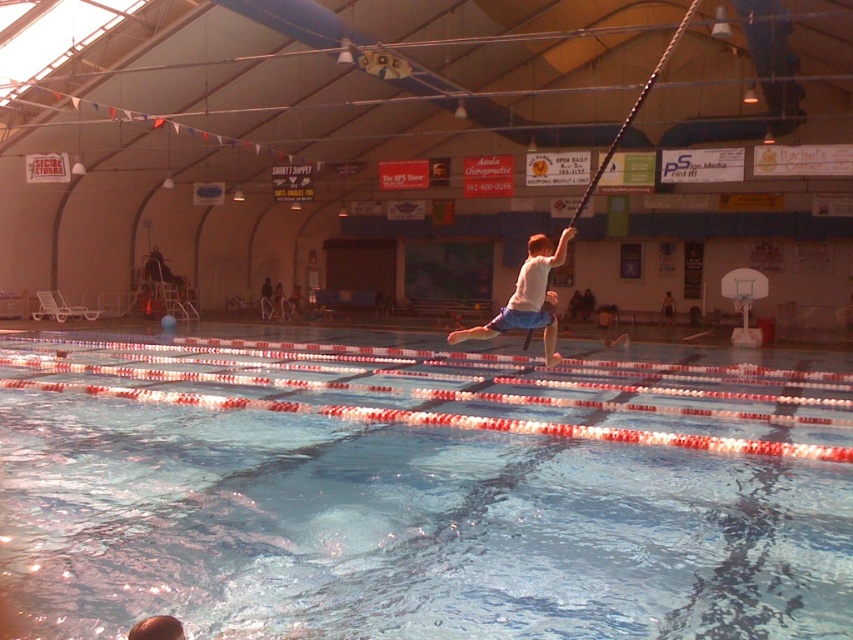
Is clear blue water at center below white matte shirt at center?

Correct, clear blue water at center is located below white matte shirt at center.

Which of these two, clear blue water at center or white matte shirt at center, stands shorter?

clear blue water at center is shorter.

Where is `clear blue water at center`? clear blue water at center is located at coordinates (416, 492).

Is white matte shirt at center smaller than light brown shorts at center?

No, white matte shirt at center is not smaller than light brown shorts at center.

Can you confirm if white matte shirt at center is positioned above light brown shorts at center?

Correct, white matte shirt at center is located above light brown shorts at center.

Is point (463, 337) more distant than point (670, 308)?

No, (463, 337) is in front of (670, 308).

Find the location of `white matte shirt at center`. white matte shirt at center is located at coordinates (527, 298).

Is clear blue water at center thinner than light brown shorts at center?

In fact, clear blue water at center might be wider than light brown shorts at center.

Looking at this image, which is above, clear blue water at center or light brown shorts at center?

Positioned higher is light brown shorts at center.

The image size is (853, 640). What do you see at coordinates (416, 492) in the screenshot?
I see `clear blue water at center` at bounding box center [416, 492].

Locate an element on the screen. clear blue water at center is located at coordinates (416, 492).